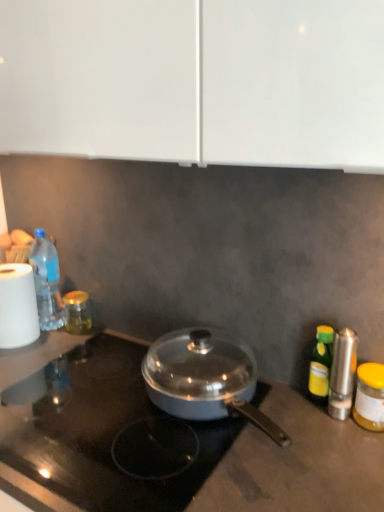
Find the location of a particular element. vacant space situated on the left part of silver metallic salt shaker at right is located at coordinates (274, 422).